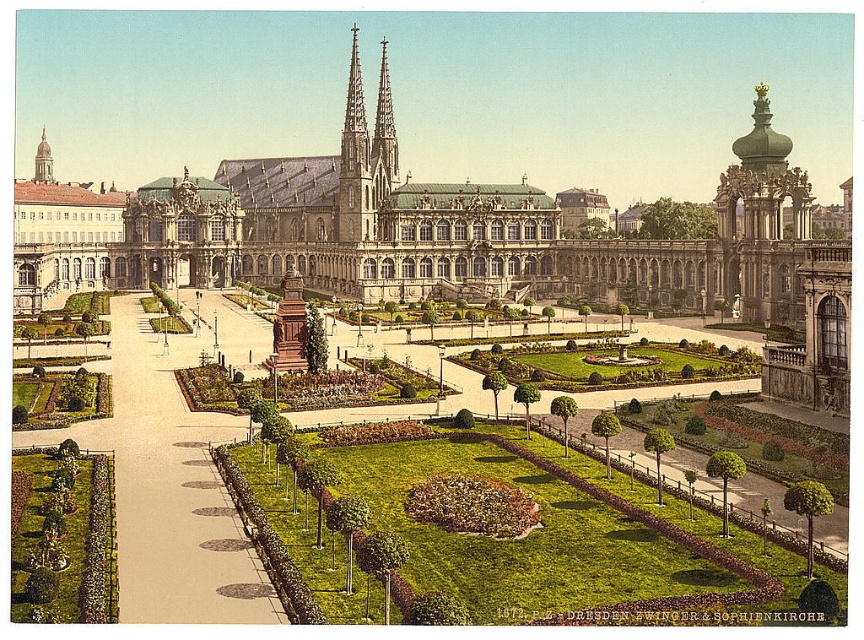
Is stone palace at center to the left of smooth stone spire at center from the viewer's perspective?

Correct, you'll find stone palace at center to the left of smooth stone spire at center.

Who is shorter, stone palace at center or smooth stone spire at center?

smooth stone spire at center is shorter.

Is point (342, 262) positioned after point (373, 131)?

No, (342, 262) is closer to viewer.

Identify the location of stone palace at center. This screenshot has height=640, width=864. (491, 234).